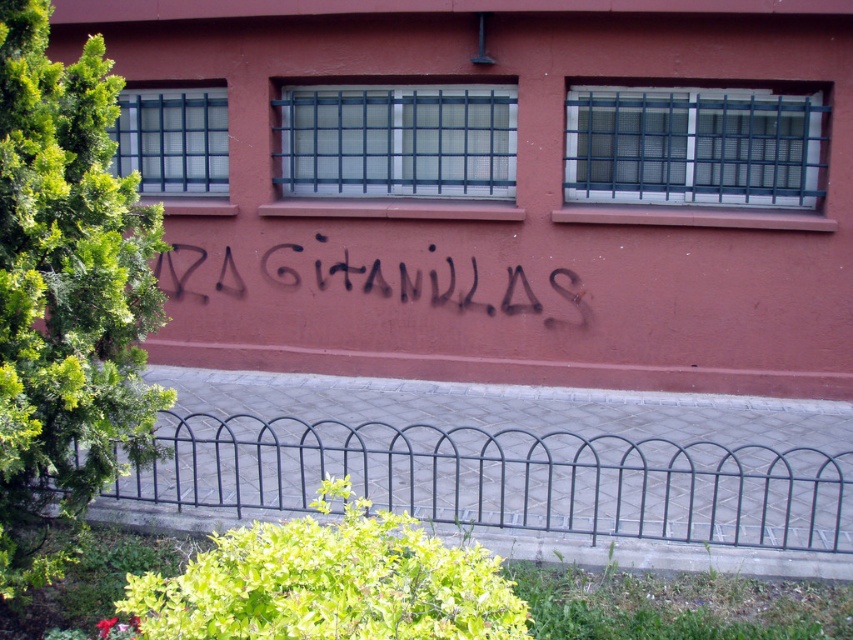
You are standing in front of the building and want to place a small potted plant between the two points, point (x=186, y=500) and point (x=483, y=307). Which point should the plant be closer to if you want it to be nearer to the viewer?

The plant should be placed closer to point (x=186, y=500) because it is closer to the viewer than point (x=483, y=307).

Based on the photo, you are a maintenance worker needing to clean the black spray paint graffiti at center. You have a ladder that is 2 meters long. Can you reach the graffiti from the black metal fence at lower center without moving the ladder?

The black metal fence at lower center is 2.07 meters from the black spray paint graffiti at center. Since the ladder is only 2 meters long, it is 7 centimeters too short to reach the graffiti from the fence.